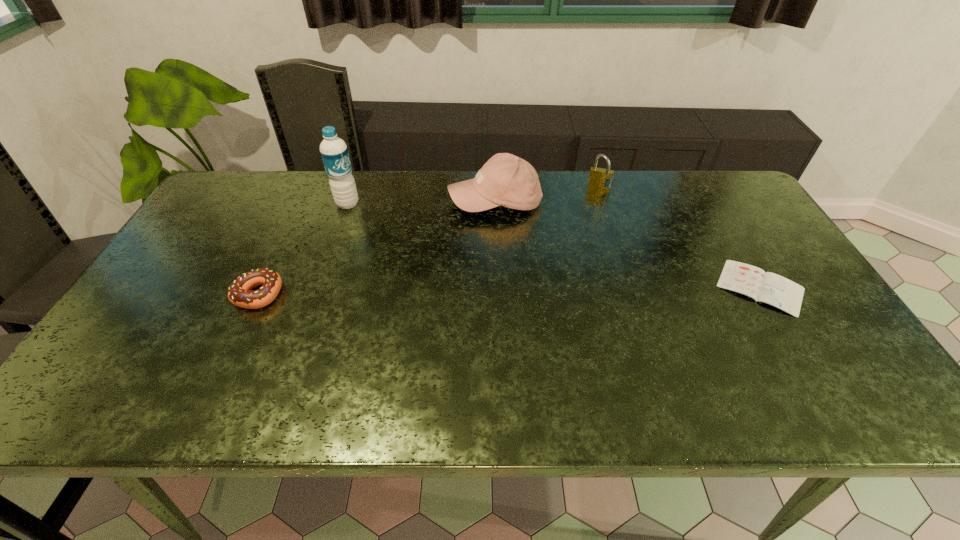
Identify the location of the leftmost object. (240, 294).

At what (x,y) coordinates should I click in order to perform the action: click on doughnut. Please return your answer as a coordinate pair (x, y). Looking at the image, I should click on (240, 294).

Image resolution: width=960 pixels, height=540 pixels. Find the location of `diary`. diary is located at coordinates (767, 287).

The image size is (960, 540). Find the location of `the rightmost object`. the rightmost object is located at coordinates (767, 287).

You are a GUI agent. You are given a task and a screenshot of the screen. Output one action in this format:
    pyautogui.click(x=<x>, y=<y>)
    Task: Click on the fourth object from left to right
    
    Given the screenshot: What is the action you would take?
    pyautogui.click(x=600, y=178)

Find the location of a particular element. the third shortest object is located at coordinates (600, 178).

The width and height of the screenshot is (960, 540). Find the location of `the fourth shortest object`. the fourth shortest object is located at coordinates (506, 180).

The width and height of the screenshot is (960, 540). What are the coordinates of `the third object from left to right` in the screenshot? It's located at (506, 180).

I want to click on the tallest object, so click(334, 152).

This screenshot has width=960, height=540. I want to click on the fourth object from right to left, so click(334, 152).